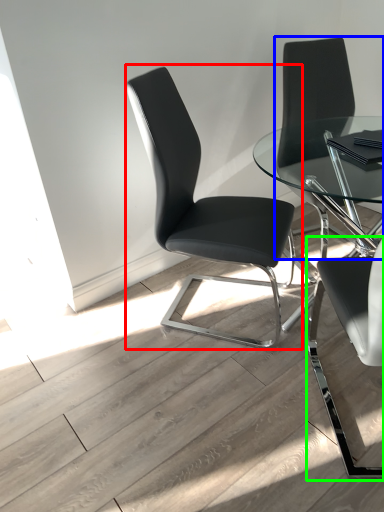
Question: Which is nearer to the chair (highlighted by a red box)? chair (highlighted by a blue box) or chair (highlighted by a green box).

Choices:
 (A) chair
 (B) chair

Answer: (B)